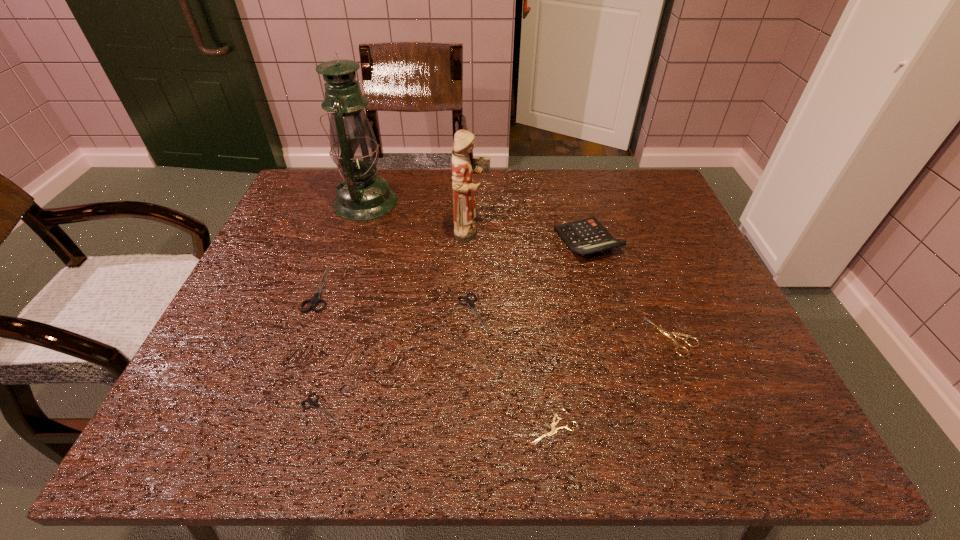
Where is `free space at the far left corner of the desktop`? free space at the far left corner of the desktop is located at coordinates (296, 187).

Locate an element on the screen. This screenshot has width=960, height=540. free region at the far right corner of the desktop is located at coordinates (643, 203).

Where is `vacant space in between the second tallest shears and the calculator`? This screenshot has width=960, height=540. vacant space in between the second tallest shears and the calculator is located at coordinates (531, 276).

This screenshot has width=960, height=540. In order to click on free spot between the shortest object and the leftmost shears in this screenshot , I will do `click(437, 357)`.

Locate an element on the screen. The width and height of the screenshot is (960, 540). vacant space that is in between the bigger beige shears and the leftmost shears is located at coordinates (496, 313).

Locate an element on the screen. The height and width of the screenshot is (540, 960). vacant space that's between the oil lamp and the smallest black shears is located at coordinates (344, 305).

The image size is (960, 540). Identify the location of vacant space that is in between the second black shears from left to right and the shortest object. (439, 418).

You are a GUI agent. You are given a task and a screenshot of the screen. Output one action in this format:
    pyautogui.click(x=<x>, y=<y>)
    Task: Click on the free spot between the leftmost shears and the second shears from left to right
    The height and width of the screenshot is (540, 960).
    Given the screenshot: What is the action you would take?
    pyautogui.click(x=322, y=348)

Where is `empty space between the tallest object and the calculator`? The image size is (960, 540). empty space between the tallest object and the calculator is located at coordinates (477, 221).

Find the location of a particular element. unoccupied position between the oil lamp and the fourth tallest object is located at coordinates (343, 245).